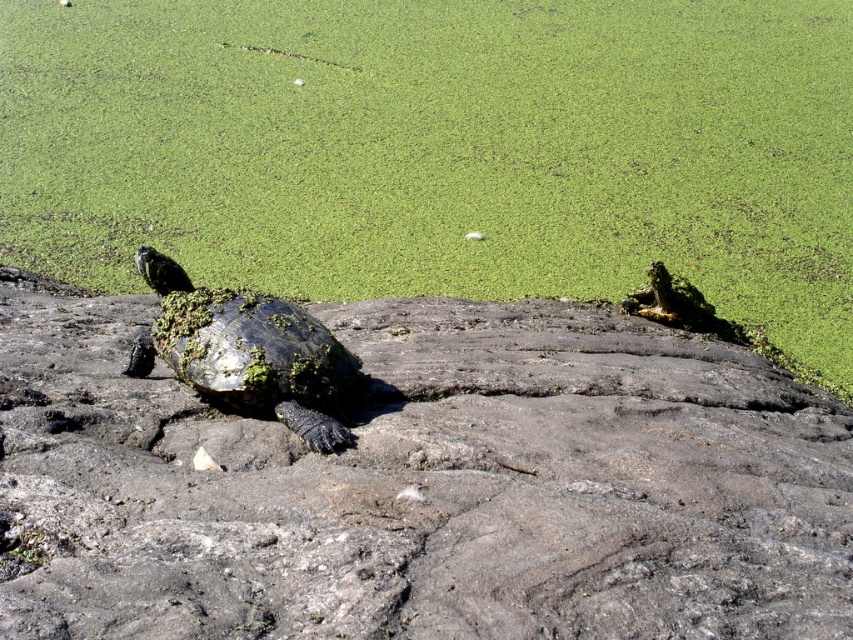
Question: Does green mossy algae at upper left have a greater width compared to green mossy tortoise at center?

Choices:
 (A) yes
 (B) no

Answer: (A)

Question: Can you confirm if rough textured rock at center is positioned to the left of green mossy algae at upper left?

Choices:
 (A) no
 (B) yes

Answer: (B)

Question: Where is green mossy algae at upper left located in relation to green mossy tortoise at center in the image?

Choices:
 (A) left
 (B) right

Answer: (B)

Question: Which object is farther from the camera taking this photo?

Choices:
 (A) rough textured rock at center
 (B) green mossy algae at upper left

Answer: (B)

Question: Which point is farther to the camera?

Choices:
 (A) (193, 230)
 (B) (334, 355)

Answer: (A)

Question: Which object is positioned farthest from the green mossy algae at upper left?

Choices:
 (A) rough textured rock at center
 (B) green mossy tortoise at center

Answer: (B)